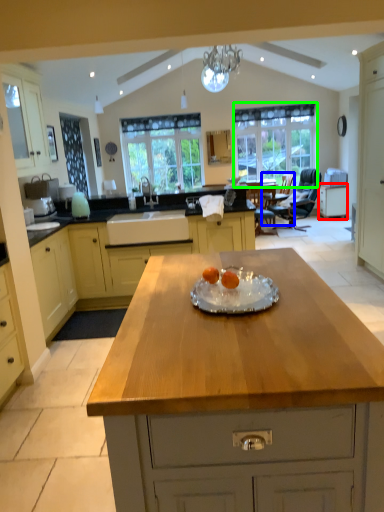
Question: Estimate the real-world distances between objects in this image. Which object is closer to cabinetry (highlighted by a red box), armchair (highlighted by a blue box) or window (highlighted by a green box)?

Choices:
 (A) armchair
 (B) window

Answer: (A)